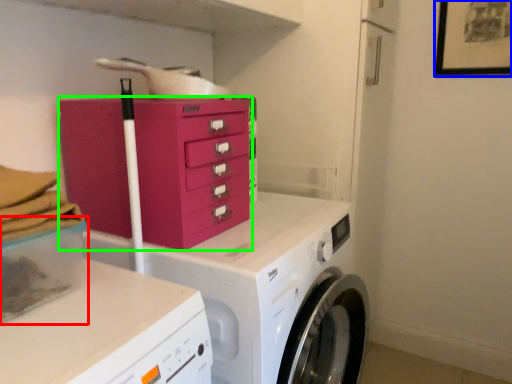
Question: Which is nearer to the storage box (highlighted by a red box)? picture frame (highlighted by a blue box) or chest of drawers (highlighted by a green box).

Choices:
 (A) picture frame
 (B) chest of drawers

Answer: (B)